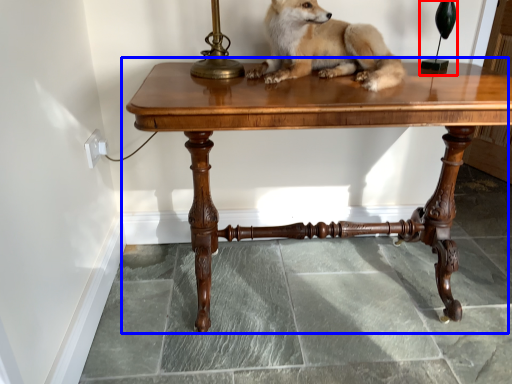
Question: Which object is further to the camera taking this photo, table lamp (highlighted by a red box) or table (highlighted by a blue box)?

Choices:
 (A) table lamp
 (B) table

Answer: (A)